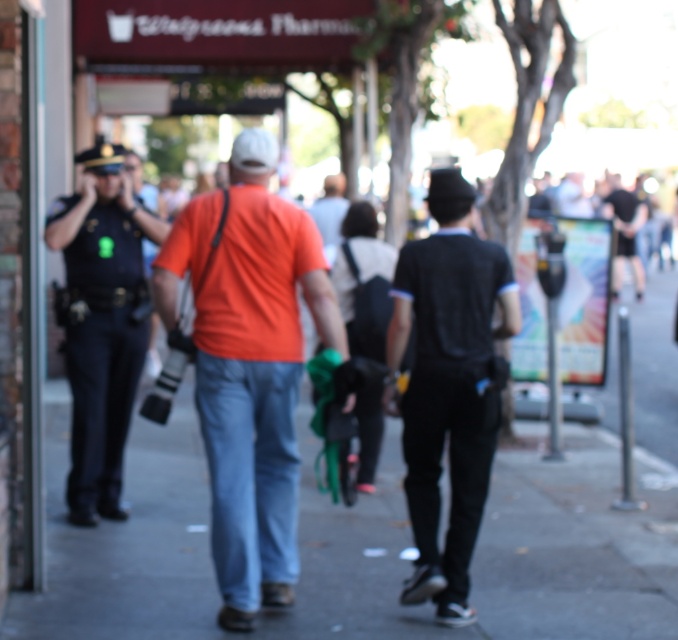
Question: Can you confirm if black uniform at left is positioned above dark blue jeans at center?

Choices:
 (A) yes
 (B) no

Answer: (B)

Question: From the image, what is the correct spatial relationship of smooth concrete sidewalk at center in relation to orange cotton shirt at center?

Choices:
 (A) right
 (B) left

Answer: (A)

Question: Which object appears closest to the camera in this image?

Choices:
 (A) dark blue jeans at center
 (B) black matte shirt at center

Answer: (B)

Question: Does black matte shirt at center appear under black uniform at left?

Choices:
 (A) no
 (B) yes

Answer: (B)

Question: Which point is farther from the camera taking this photo?

Choices:
 (A) (639, 292)
 (B) (54, 410)
 (C) (62, 198)
 (D) (443, 586)

Answer: (A)

Question: Which of the following is the closest to the observer?

Choices:
 (A) (519, 528)
 (B) (452, 330)

Answer: (B)